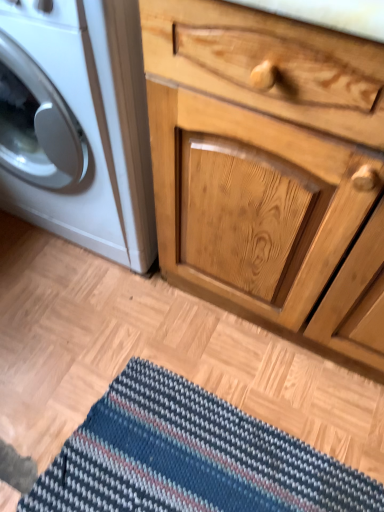
Question: Is striped fabric doormat at lower center bigger or smaller than natural wood cabinet at center?

Choices:
 (A) big
 (B) small

Answer: (B)

Question: Which is correct: striped fabric doormat at lower center is inside natural wood cabinet at center, or outside of it?

Choices:
 (A) outside
 (B) inside

Answer: (A)

Question: Estimate the real-world distances between objects in this image. Which object is closer to the striped fabric doormat at lower center?

Choices:
 (A) natural wood cabinet at center
 (B) white glossy washing machine at left

Answer: (A)

Question: Considering the real-world distances, which object is farthest from the white glossy washing machine at left?

Choices:
 (A) striped fabric doormat at lower center
 (B) natural wood cabinet at center

Answer: (A)